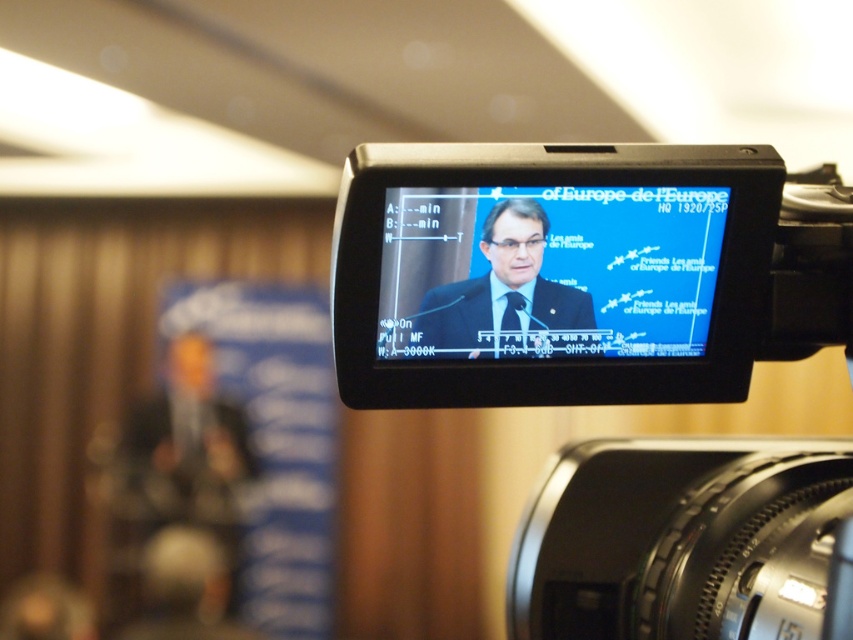
You are a technician adjusting the video camera settings. You need to locate the black plastic video camera at center and the matte black monitor at center. Which one is positioned to the right of the other?

The black plastic video camera at center is positioned to the right of the matte black monitor at center.